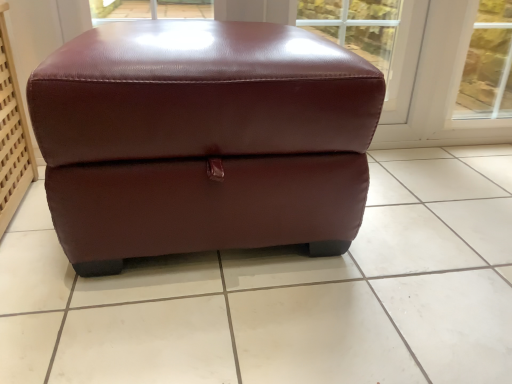
In order to click on burgundy leather ottoman at center in this screenshot , I will do `click(285, 294)`.

The width and height of the screenshot is (512, 384). What do you see at coordinates (285, 294) in the screenshot?
I see `burgundy leather ottoman at center` at bounding box center [285, 294].

In order to click on burgundy leather ottoman at center in this screenshot , I will do `click(202, 140)`.

What do you see at coordinates (202, 140) in the screenshot?
I see `burgundy leather ottoman at center` at bounding box center [202, 140].

Measure the distance between burgundy leather ottoman at center and camera.

They are 26.58 inches apart.

The width and height of the screenshot is (512, 384). I want to click on burgundy leather ottoman at center, so click(x=285, y=294).

Which object is positioned more to the left, burgundy leather ottoman at center or burgundy leather ottoman at center?

From the viewer's perspective, burgundy leather ottoman at center appears more on the left side.

Looking at this image, does burgundy leather ottoman at center come behind burgundy leather ottoman at center?

No, the depth of burgundy leather ottoman at center is less than that of burgundy leather ottoman at center.

Between point (457, 308) and point (99, 190), which one is positioned in front?

The point (99, 190) is closer.

From the image's perspective, which is below, burgundy leather ottoman at center or burgundy leather ottoman at center?

burgundy leather ottoman at center is shown below in the image.

From a real-world perspective, is burgundy leather ottoman at center on top of burgundy leather ottoman at center?

No, from a real-world perspective, burgundy leather ottoman at center is not over burgundy leather ottoman at center

Based on the photo, is burgundy leather ottoman at center wider or thinner than burgundy leather ottoman at center?

Clearly, burgundy leather ottoman at center has more width compared to burgundy leather ottoman at center.

Can you confirm if burgundy leather ottoman at center is taller than burgundy leather ottoman at center?

In fact, burgundy leather ottoman at center may be shorter than burgundy leather ottoman at center.

Is burgundy leather ottoman at center bigger or smaller than burgundy leather ottoman at center?

burgundy leather ottoman at center is smaller than burgundy leather ottoman at center.

Would you say burgundy leather ottoman at center is part of burgundy leather ottoman at center's contents?

No, burgundy leather ottoman at center is not a part of burgundy leather ottoman at center.

Are burgundy leather ottoman at center and burgundy leather ottoman at center far apart?

burgundy leather ottoman at center is actually quite close to burgundy leather ottoman at center.

Is burgundy leather ottoman at center oriented towards burgundy leather ottoman at center?

No.

How many degrees apart are the facing directions of burgundy leather ottoman at center and burgundy leather ottoman at center?

The facing directions of burgundy leather ottoman at center and burgundy leather ottoman at center are 90.4 degrees apart.

At what (x,y) coordinates should I click in order to perform the action: click on furniture that is above the burgundy leather ottoman at center (from the image's perspective). Please return your answer as a coordinate pair (x, y). The image size is (512, 384). Looking at the image, I should click on (202, 140).

Is burgundy leather ottoman at center at the left side of burgundy leather ottoman at center?

Yes, burgundy leather ottoman at center is to the left of burgundy leather ottoman at center.

Between burgundy leather ottoman at center and burgundy leather ottoman at center, which one is positioned in front?

burgundy leather ottoman at center is closer to the camera.

Does point (81, 189) come closer to viewer compared to point (496, 188)?

That is True.

From the image's perspective, between burgundy leather ottoman at center and burgundy leather ottoman at center, which one is located above?

burgundy leather ottoman at center.

From a real-world perspective, is burgundy leather ottoman at center physically located above or below burgundy leather ottoman at center?

In terms of real-world spatial position, burgundy leather ottoman at center is above burgundy leather ottoman at center.

Considering the relative sizes of burgundy leather ottoman at center and burgundy leather ottoman at center in the image provided, is burgundy leather ottoman at center thinner than burgundy leather ottoman at center?

Indeed, burgundy leather ottoman at center has a lesser width compared to burgundy leather ottoman at center.

Can you confirm if burgundy leather ottoman at center is shorter than burgundy leather ottoman at center?

Incorrect, the height of burgundy leather ottoman at center does not fall short of that of burgundy leather ottoman at center.

Between burgundy leather ottoman at center and burgundy leather ottoman at center, which one has larger size?

With larger size is burgundy leather ottoman at center.

Which is correct: burgundy leather ottoman at center is inside burgundy leather ottoman at center, or outside of it?

burgundy leather ottoman at center exists outside the volume of burgundy leather ottoman at center.

Is burgundy leather ottoman at center far from burgundy leather ottoman at center?

They are positioned close to each other.

From the picture: Is burgundy leather ottoman at center facing towards burgundy leather ottoman at center?

No, burgundy leather ottoman at center is not aimed at burgundy leather ottoman at center.

Based on the photo, can you tell me how much burgundy leather ottoman at center and burgundy leather ottoman at center differ in facing direction?

The angular difference between burgundy leather ottoman at center and burgundy leather ottoman at center is 90.4 degrees.

In the image, there is a burgundy leather ottoman at center. Where is `tile below it (from a real-world perspective)`? tile below it (from a real-world perspective) is located at coordinates coord(285,294).

Where is `tile in front of the burgundy leather ottoman at center`? This screenshot has height=384, width=512. tile in front of the burgundy leather ottoman at center is located at coordinates (285, 294).

At what (x,y) coordinates should I click in order to perform the action: click on furniture behind the burgundy leather ottoman at center. Please return your answer as a coordinate pair (x, y). The height and width of the screenshot is (384, 512). Looking at the image, I should click on (202, 140).